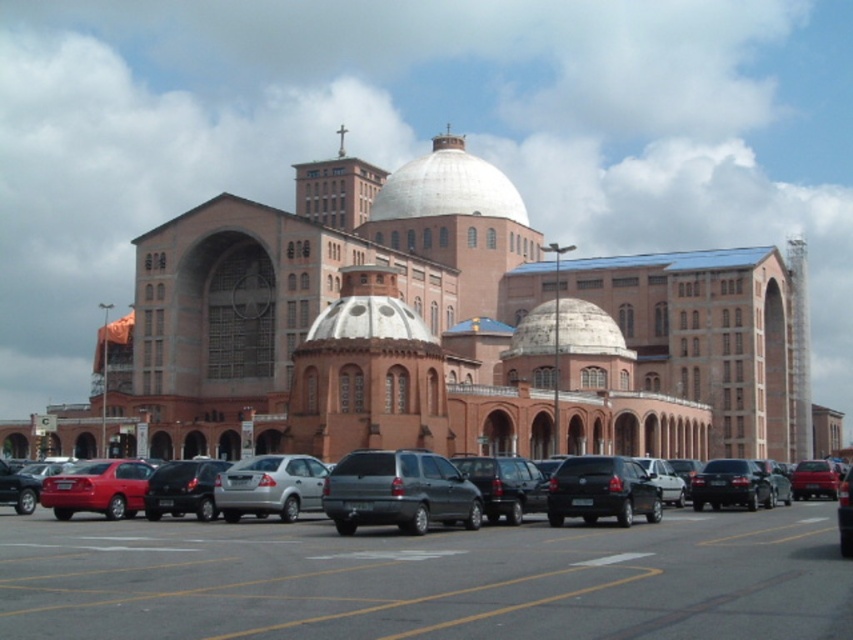
Question: Estimate the real-world distances between objects in this image. Which object is farther from the white matte dome at center?

Choices:
 (A) silver metallic sedan at center
 (B) black asphalt parking lot at lower center
 (C) matte black suv at center

Answer: (B)

Question: Is black asphalt parking lot at lower center below white matte dome at center?

Choices:
 (A) yes
 (B) no

Answer: (A)

Question: Is brick church at center to the right of silver metallic sedan at center from the viewer's perspective?

Choices:
 (A) no
 (B) yes

Answer: (B)

Question: Does matte black suv at center have a smaller size compared to white matte dome at center?

Choices:
 (A) no
 (B) yes

Answer: (B)

Question: Which point is closer to the camera?

Choices:
 (A) matte black car at center
 (B) matte black suv at center

Answer: (A)

Question: Estimate the real-world distances between objects in this image. Which object is closer to the silver metallic sedan at center?

Choices:
 (A) matte black suv at center
 (B) matte black car at center
 (C) white matte dome at center

Answer: (A)